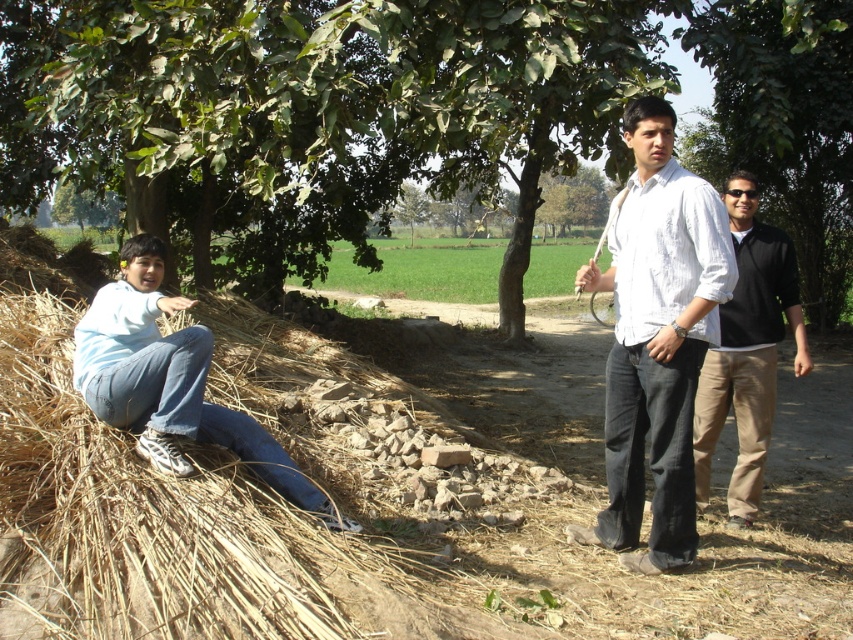
Question: Among these objects, which one is nearest to the camera?

Choices:
 (A) green leafy tree at upper left
 (B) black cotton shirt at right
 (C) brown dirt field at center
 (D) green leafy tree at center

Answer: (C)

Question: Does white cotton shirt at center have a larger size compared to light blue denim jeans at left?

Choices:
 (A) no
 (B) yes

Answer: (A)

Question: Among these points, which one is nearest to the camera?

Choices:
 (A) (654, 497)
 (B) (734, 115)
 (C) (103, 344)

Answer: (C)

Question: Estimate the real-world distances between objects in this image. Which object is farther from the light blue denim jeans at left?

Choices:
 (A) green leafy tree at center
 (B) black cotton shirt at right
 (C) white cotton shirt at center

Answer: (A)

Question: Does brown dirt field at center appear under green leafy tree at upper left?

Choices:
 (A) no
 (B) yes

Answer: (B)

Question: Does green leafy tree at center lie behind light blue denim jeans at left?

Choices:
 (A) yes
 (B) no

Answer: (A)